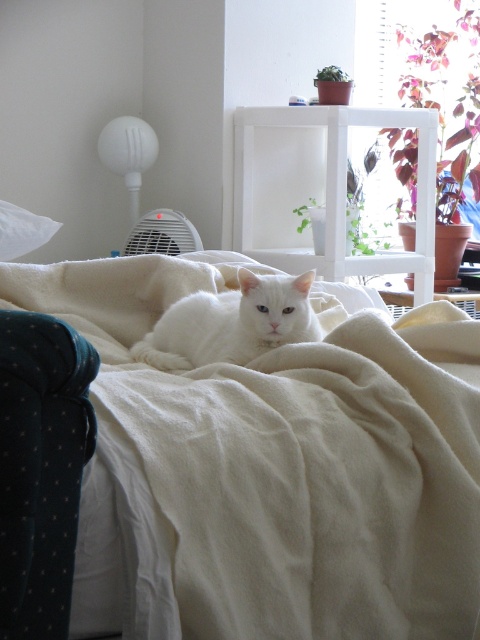
Question: Can you confirm if white soft blanket at center is positioned to the left of white fluffy cat at center?

Choices:
 (A) no
 (B) yes

Answer: (A)

Question: Which object appears closest to the camera in this image?

Choices:
 (A) white soft blanket at center
 (B) white fluffy cat at center

Answer: (A)

Question: Is white soft blanket at center above white fluffy cat at center?

Choices:
 (A) yes
 (B) no

Answer: (B)

Question: Which object is closer to the camera taking this photo?

Choices:
 (A) white fluffy cat at center
 (B) white soft blanket at center

Answer: (B)

Question: Which point is closer to the camera taking this photo?

Choices:
 (A) (123, 381)
 (B) (249, 333)

Answer: (A)

Question: Observing the image, what is the correct spatial positioning of white soft blanket at center in reference to white fluffy cat at center?

Choices:
 (A) right
 (B) left

Answer: (A)